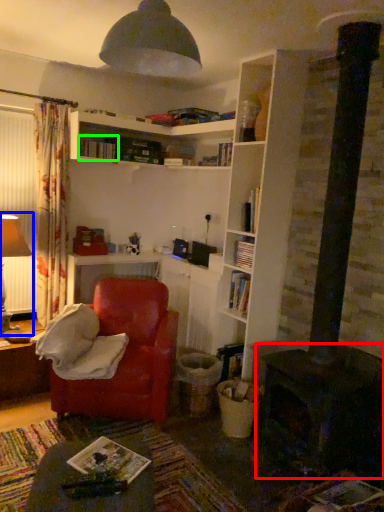
Question: Considering the real-world distances, which object is closest to fireplace (highlighted by a red box)? table lamp (highlighted by a blue box) or book (highlighted by a green box).

Choices:
 (A) table lamp
 (B) book

Answer: (A)